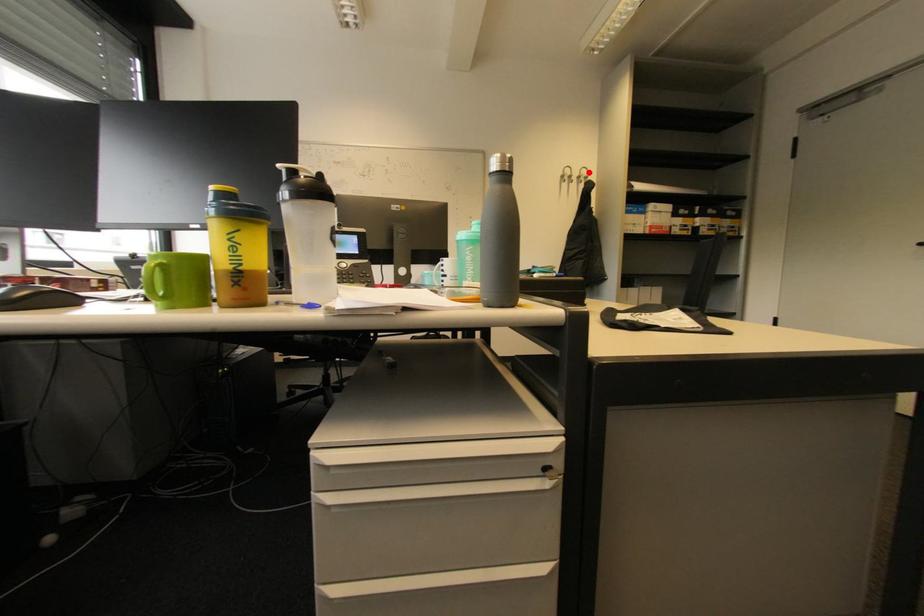
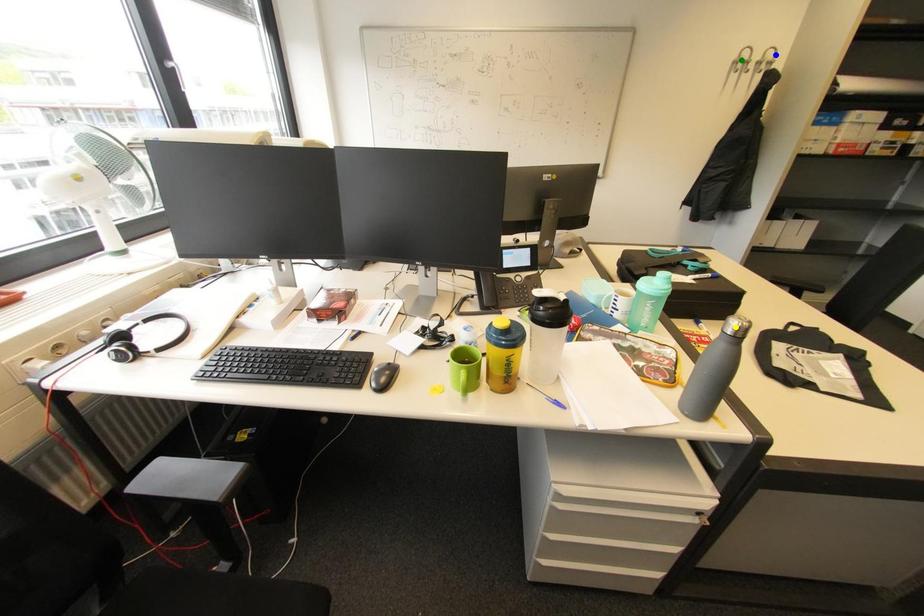
Question: I am providing you with two images of the same scene from different viewpoints. A red point is marked on the first image. You are given multiple points on the second image. In image 2, which mark is for the same physical point as the one in image 1?

Choices:
 (A) blue point
 (B) green point
 (C) yellow point

Answer: (A)